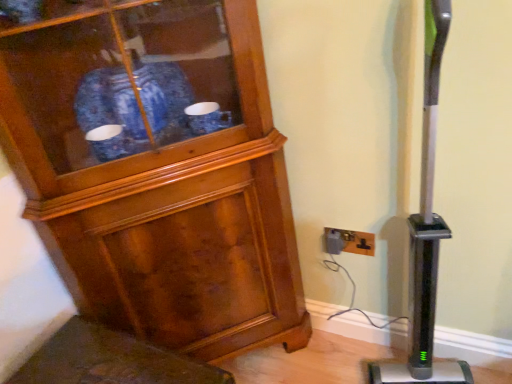
Identify the location of black plastic outlet at lower right. (348, 242).

The image size is (512, 384). Describe the element at coordinates (348, 242) in the screenshot. I see `black plastic outlet at lower right` at that location.

Measure the distance between point (370, 233) and camera.

Point (370, 233) is 1.18 meters away from camera.

The width and height of the screenshot is (512, 384). Describe the element at coordinates (160, 198) in the screenshot. I see `wooden cabinet at left` at that location.

The width and height of the screenshot is (512, 384). I want to click on wooden cabinet at left, so (x=160, y=198).

Locate an element on the screen. The height and width of the screenshot is (384, 512). black plastic outlet at lower right is located at coordinates (348, 242).

Is wooden cabinet at left to the left or to the right of black plastic outlet at lower right in the image?

In the image, wooden cabinet at left appears on the left side of black plastic outlet at lower right.

Between wooden cabinet at left and black plastic outlet at lower right, which one is positioned in front?

wooden cabinet at left.

Which is behind, point (5, 106) or point (345, 250)?

The point (345, 250) is farther from the camera.

Based on the photo, from the image's perspective, which is above, wooden cabinet at left or black plastic outlet at lower right?

wooden cabinet at left, from the image's perspective.

Based on the photo, from a real-world perspective, which is physically below, wooden cabinet at left or black plastic outlet at lower right?

From a 3D spatial view, black plastic outlet at lower right is below.

Considering the sizes of objects wooden cabinet at left and black plastic outlet at lower right in the image provided, who is thinner, wooden cabinet at left or black plastic outlet at lower right?

Thinner between the two is black plastic outlet at lower right.

Based on the photo, does wooden cabinet at left have a greater height compared to black plastic outlet at lower right?

Yes, wooden cabinet at left is taller than black plastic outlet at lower right.

Is wooden cabinet at left bigger than black plastic outlet at lower right?

Indeed, wooden cabinet at left has a larger size compared to black plastic outlet at lower right.

Would you say wooden cabinet at left contains black plastic outlet at lower right?

That's incorrect, black plastic outlet at lower right is not inside wooden cabinet at left.

Is wooden cabinet at left placed right next to black plastic outlet at lower right?

They are not placed beside each other.

Could you tell me if wooden cabinet at left is facing black plastic outlet at lower right?

No.

What's the angular difference between wooden cabinet at left and black plastic outlet at lower right's facing directions?

The facing directions of wooden cabinet at left and black plastic outlet at lower right are 45 degrees apart.

Identify the location of electric outlet lying below the wooden cabinet at left (from the image's perspective). The height and width of the screenshot is (384, 512). (348, 242).

Considering the relative positions of black plastic outlet at lower right and wooden cabinet at left in the image provided, is black plastic outlet at lower right to the right of wooden cabinet at left from the viewer's perspective?

Yes.

Is black plastic outlet at lower right in front of wooden cabinet at left?

That is False.

Which is closer, (328,232) or (144,167)?

The point (144,167) is closer.

From the image's perspective, is black plastic outlet at lower right beneath wooden cabinet at left?

A: Correct, black plastic outlet at lower right appears lower than wooden cabinet at left in the image.

From a real-world perspective, who is located higher, black plastic outlet at lower right or wooden cabinet at left?

wooden cabinet at left is physically above.

Which object is wider, black plastic outlet at lower right or wooden cabinet at left?

wooden cabinet at left.

Which of these two, black plastic outlet at lower right or wooden cabinet at left, stands taller?

Standing taller between the two is wooden cabinet at left.

Between black plastic outlet at lower right and wooden cabinet at left, which one has larger size?

wooden cabinet at left is bigger.

Is black plastic outlet at lower right inside or outside of wooden cabinet at left?

The correct answer is: outside.

Is black plastic outlet at lower right not near wooden cabinet at left?

No, black plastic outlet at lower right is not far away from wooden cabinet at left.

Is black plastic outlet at lower right looking in the opposite direction of wooden cabinet at left?

No, black plastic outlet at lower right is not facing the opposite direction of wooden cabinet at left.

Image resolution: width=512 pixels, height=384 pixels. I want to click on electric outlet that appears below the wooden cabinet at left (from a real-world perspective), so 348,242.

Find the location of `electric outlet behind the wooden cabinet at left`. electric outlet behind the wooden cabinet at left is located at coordinates (348, 242).

Identify the location of cupboard that appears above the black plastic outlet at lower right (from the image's perspective). Image resolution: width=512 pixels, height=384 pixels. (160, 198).